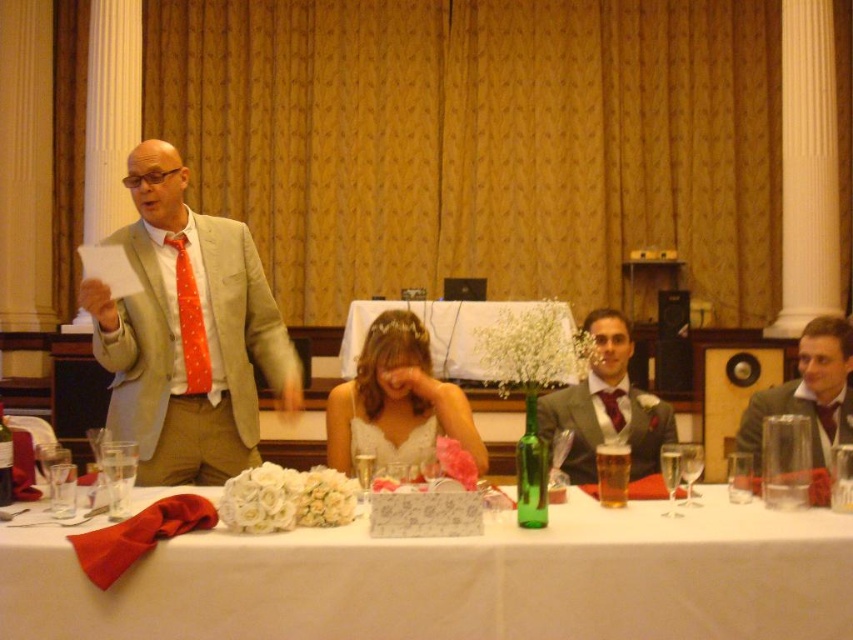
Between white satin dress at center and matte gray suit at right, which one has more height?

With more height is white satin dress at center.

Is point (409, 440) farther from camera compared to point (798, 400)?

No, (409, 440) is closer to viewer.

Between point (428, 387) and point (801, 413), which one is positioned in front?

Point (428, 387) is more forward.

The image size is (853, 640). What are the coordinates of `white satin dress at center` in the screenshot? It's located at (397, 401).

Who is shorter, white satin dress at center or white satin tablecloth at center?

white satin dress at center is shorter.

Does white satin dress at center appear over white satin tablecloth at center?

No.

Which is in front, point (332, 388) or point (444, 349)?

Point (332, 388) is in front.

Where is `white satin dress at center`? The width and height of the screenshot is (853, 640). white satin dress at center is located at coordinates (397, 401).

Can you confirm if white fabric table at center is bigger than white satin dress at center?

Yes.

Who is more distant from viewer, (x=314, y=577) or (x=352, y=417)?

Positioned behind is point (x=352, y=417).

This screenshot has height=640, width=853. I want to click on white fabric table at center, so click(x=459, y=580).